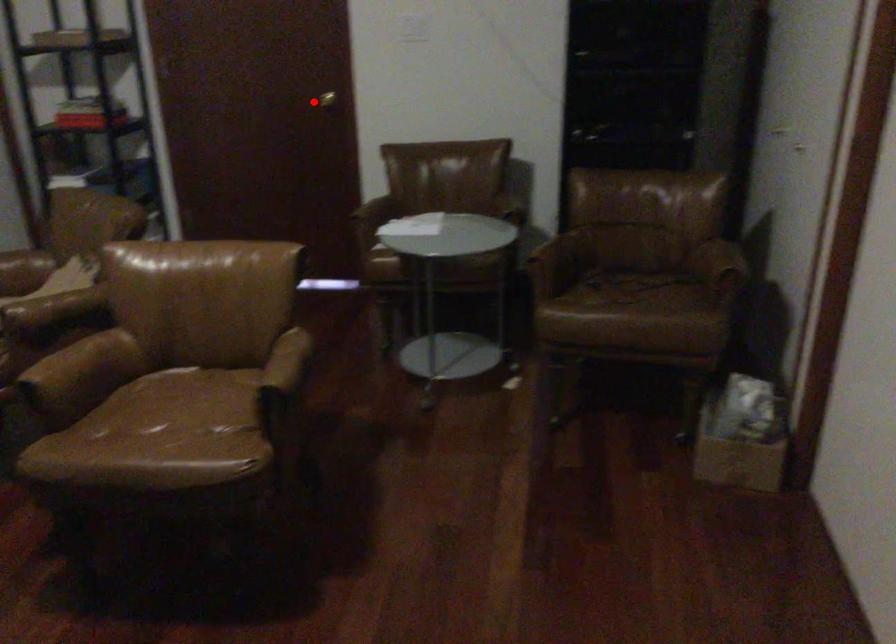
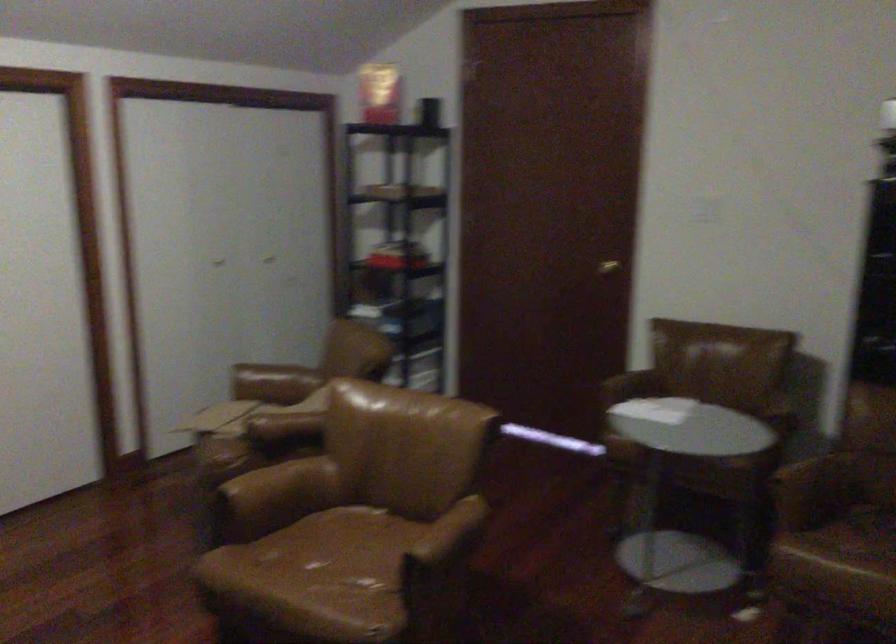
Where in the second image is the point corresponding to the highlighted location from the first image?

(607, 267)